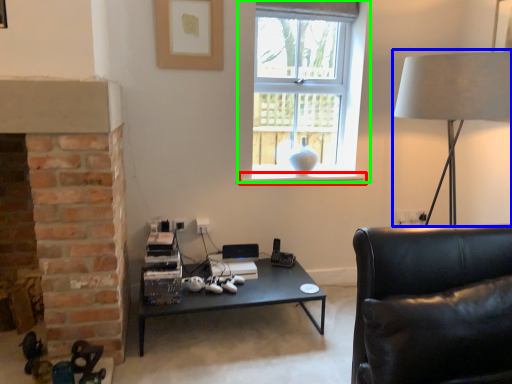
Question: Based on their relative distances, which object is nearer to window sill (highlighted by a red box)? Choose from table lamp (highlighted by a blue box) and window (highlighted by a green box).

Choices:
 (A) table lamp
 (B) window

Answer: (B)